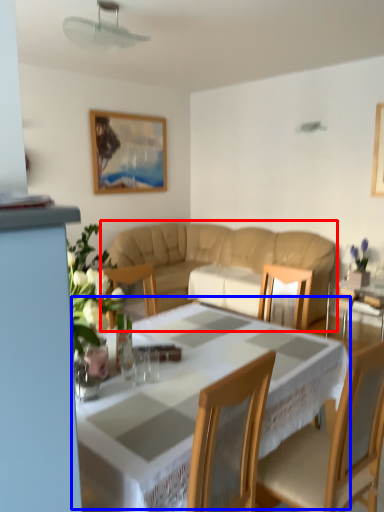
Question: Which object appears farthest to the camera in this image, studio couch (highlighted by a red box) or table (highlighted by a blue box)?

Choices:
 (A) studio couch
 (B) table

Answer: (A)